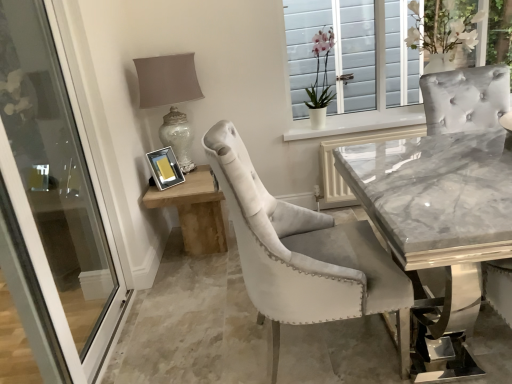
Identify the location of vacant space in metallic silver picture frame at upper center (from a real-world perspective). The height and width of the screenshot is (384, 512). (162, 184).